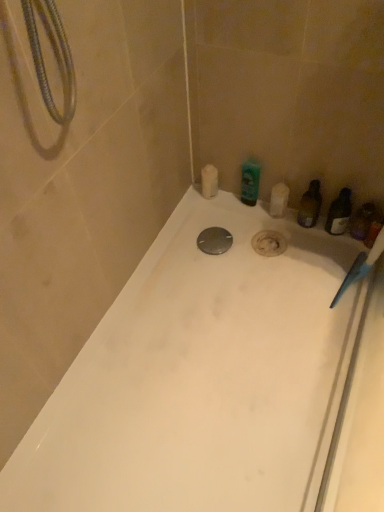
Question: Would you say green glossy bottle at upper right, acting as the 3th toiletry starting from the right, is part of translucent plastic bottle at right, marked as the second toiletry in a right-to-left arrangement,'s contents?

Choices:
 (A) no
 (B) yes

Answer: (A)

Question: Does translucent plastic bottle at right, arranged as the third toiletry when viewed from the left, have a greater width compared to green glossy bottle at upper right, acting as the 3th toiletry starting from the right?

Choices:
 (A) yes
 (B) no

Answer: (A)

Question: Does translucent plastic bottle at right, arranged as the third toiletry when viewed from the left, have a larger size compared to green glossy bottle at upper right, acting as the 3th toiletry starting from the right?

Choices:
 (A) yes
 (B) no

Answer: (A)

Question: Is translucent plastic bottle at right, marked as the second toiletry in a right-to-left arrangement, in front of green glossy bottle at upper right, acting as the 3th toiletry starting from the right?

Choices:
 (A) yes
 (B) no

Answer: (A)

Question: Is green glossy bottle at upper right, the second toiletry viewed from the left, at the back of translucent plastic bottle at right, arranged as the third toiletry when viewed from the left?

Choices:
 (A) no
 (B) yes

Answer: (A)

Question: Is translucent plastic bottle at right, marked as the second toiletry in a right-to-left arrangement, positioned beyond the bounds of green glossy bottle at upper right, the second toiletry viewed from the left?

Choices:
 (A) no
 (B) yes

Answer: (B)

Question: Is white glossy bathtub at center surrounding translucent plastic bottle at right, marked as the second toiletry in a right-to-left arrangement?

Choices:
 (A) no
 (B) yes

Answer: (A)

Question: Is white glossy bathtub at center not close to translucent plastic bottle at right, marked as the second toiletry in a right-to-left arrangement?

Choices:
 (A) no
 (B) yes

Answer: (A)

Question: Does white glossy bathtub at center turn towards translucent plastic bottle at right, marked as the second toiletry in a right-to-left arrangement?

Choices:
 (A) yes
 (B) no

Answer: (B)

Question: Is white glossy bathtub at center placed right next to translucent plastic bottle at right, arranged as the third toiletry when viewed from the left?

Choices:
 (A) no
 (B) yes

Answer: (A)

Question: Is white glossy bathtub at center positioned before translucent plastic bottle at right, arranged as the third toiletry when viewed from the left?

Choices:
 (A) yes
 (B) no

Answer: (A)

Question: From a real-world perspective, is white glossy bathtub at center under translucent plastic bottle at right, arranged as the third toiletry when viewed from the left?

Choices:
 (A) no
 (B) yes

Answer: (B)

Question: Would you say green glossy bottle at upper right, acting as the 3th toiletry starting from the right, is a long distance from white matte soap bar at upper center, which appears as the first toiletry when viewed from the left?

Choices:
 (A) no
 (B) yes

Answer: (A)